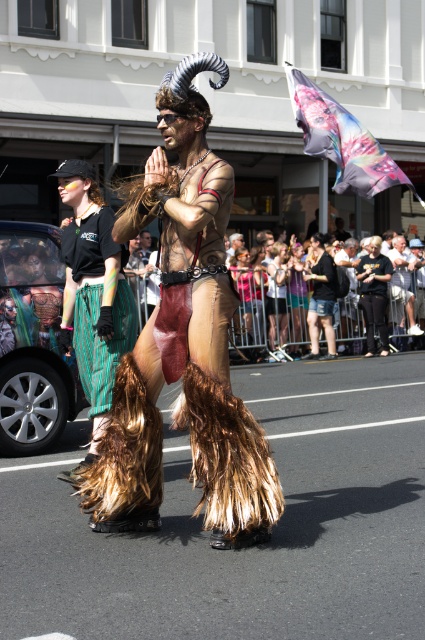
Question: Is light brown fabric crowd at center bigger than brown furry boots at lower center?

Choices:
 (A) no
 (B) yes

Answer: (B)

Question: Which object appears closest to the camera in this image?

Choices:
 (A) brown fur skirt at center
 (B) light brown fabric crowd at center

Answer: (A)

Question: Is green striped pants at left positioned before brown furry boots at lower center?

Choices:
 (A) yes
 (B) no

Answer: (A)

Question: Considering the real-world distances, which object is farthest from the green striped pants at left?

Choices:
 (A) brown furry boots at lower center
 (B) brown fur skirt at center
 (C) furry costume at center

Answer: (A)

Question: Among these points, which one is farthest from the camera?

Choices:
 (A) (141, 253)
 (B) (317, 336)
 (C) (121, 280)

Answer: (B)

Question: Is the position of brown fur skirt at center more distant than that of furry costume at center?

Choices:
 (A) no
 (B) yes

Answer: (A)